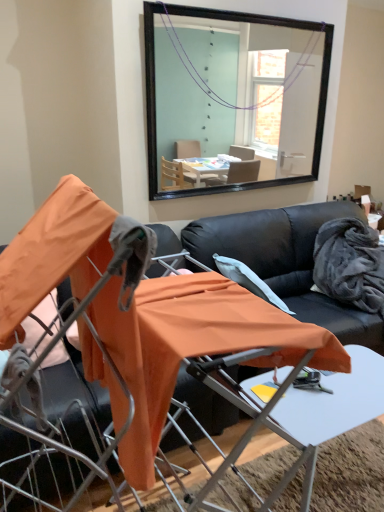
You are a GUI agent. You are given a task and a screenshot of the screen. Output one action in this format:
    pyautogui.click(x=<x>, y=<y>)
    Task: Click on the black leather couch at center
    The width and height of the screenshot is (384, 512).
    Given the screenshot: What is the action you would take?
    pyautogui.click(x=286, y=261)

From the picture: In order to face black leather couch at center, should I rotate leftwards or rightwards?

It's best to rotate right around 15.476 degrees.

Image resolution: width=384 pixels, height=512 pixels. Describe the element at coordinates (304, 414) in the screenshot. I see `orange fabric table at center` at that location.

Measure the distance between orange fabric chair at center, positioned as the second chair in left-to-right order, and camera.

The distance of orange fabric chair at center, positioned as the second chair in left-to-right order, from camera is 27.67 inches.

What do you see at coordinates (62, 446) in the screenshot? I see `orange fabric chair at center, marked as the second chair in a right-to-left arrangement` at bounding box center [62, 446].

What is the approximate width of orange fabric chair at center, marked as the second chair in a right-to-left arrangement?

The width of orange fabric chair at center, marked as the second chair in a right-to-left arrangement, is 64.57 centimeters.

The image size is (384, 512). I want to click on black leather couch at center, so click(286, 261).

Is the surface of velvety gray blanket at right in direct contact with orange fabric chair at center, the 1th chair when ordered from left to right?

No, velvety gray blanket at right is not beside orange fabric chair at center, the 1th chair when ordered from left to right.

How many degrees apart are the facing directions of velvety gray blanket at right and orange fabric chair at center, the 1th chair when ordered from left to right?

→ The angle between the facing direction of velvety gray blanket at right and the facing direction of orange fabric chair at center, the 1th chair when ordered from left to right, is 4.3 degrees.

Is velvety gray blanket at right oriented away from orange fabric chair at center, marked as the second chair in a right-to-left arrangement?

No, velvety gray blanket at right is not facing away from orange fabric chair at center, marked as the second chair in a right-to-left arrangement.

Consider the image. Considering the sizes of objects velvety gray blanket at right and orange fabric chair at center, the 1th chair when ordered from left to right, in the image provided, who is bigger, velvety gray blanket at right or orange fabric chair at center, the 1th chair when ordered from left to right,?

orange fabric chair at center, the 1th chair when ordered from left to right, is bigger.

Between point (289, 241) and point (356, 223), which one is positioned in front?

The point (289, 241) is in front.

Considering the sizes of objects black leather couch at center and velvety gray blanket at right in the image provided, who is smaller, black leather couch at center or velvety gray blanket at right?

velvety gray blanket at right.

Is black leather couch at center touching velvety gray blanket at right?

No, black leather couch at center is not making contact with velvety gray blanket at right.

Does orange fabric table at center lie in front of velvety gray blanket at right?

Yes.

Could you tell me if orange fabric table at center is facing velvety gray blanket at right?

No, orange fabric table at center is not aimed at velvety gray blanket at right.

Visually, is orange fabric table at center positioned to the left or to the right of velvety gray blanket at right?

orange fabric table at center is positioned on velvety gray blanket at right's left side.

Is point (355, 345) positioned before point (358, 254)?

Yes, point (355, 345) is closer to viewer.

From the image's perspective, would you say orange fabric table at center is positioned over orange fabric chair at center, the first chair when ordered from right to left?

Incorrect, from the image's perspective, orange fabric table at center is lower than orange fabric chair at center, the first chair when ordered from right to left.

Identify the location of the 1st chair above the orange fabric table at center (from the image's perspective). (190, 346).

Is orange fabric table at center behind orange fabric chair at center, positioned as the second chair in left-to-right order?

Yes, orange fabric table at center is behind orange fabric chair at center, positioned as the second chair in left-to-right order.

Is orange fabric table at center oriented towards orange fabric chair at center, positioned as the second chair in left-to-right order?

No, orange fabric table at center is not oriented towards orange fabric chair at center, positioned as the second chair in left-to-right order.

Would you say velvety gray blanket at right is to the left or to the right of orange fabric table at center in the picture?

velvety gray blanket at right is positioned on orange fabric table at center's right side.

The width and height of the screenshot is (384, 512). Identify the location of table below the velvety gray blanket at right (from the image's perspective). (304, 414).

Is velvety gray blanket at right beside orange fabric table at center?

velvety gray blanket at right is not next to orange fabric table at center, and they're not touching.

Would you say orange fabric table at center is part of velvety gray blanket at right's contents?

No, orange fabric table at center is not inside velvety gray blanket at right.

Considering the relative sizes of black leather couch at center and orange fabric chair at center, the first chair when ordered from right to left, in the image provided, is black leather couch at center smaller than orange fabric chair at center, the first chair when ordered from right to left,?

No.

Considering the positions of objects black leather couch at center and orange fabric chair at center, the first chair when ordered from right to left, in the image provided, who is more to the right, black leather couch at center or orange fabric chair at center, the first chair when ordered from right to left,?

black leather couch at center is more to the right.

The image size is (384, 512). I want to click on chair located below the black leather couch at center (from the image's perspective), so click(x=190, y=346).

From a real-world perspective, is black leather couch at center located beneath orange fabric chair at center, the first chair when ordered from right to left?

Yes, from a real-world perspective, black leather couch at center is under orange fabric chair at center, the first chair when ordered from right to left.

Considering the relative sizes of black leather couch at center and orange fabric chair at center, marked as the second chair in a right-to-left arrangement, in the image provided, is black leather couch at center shorter than orange fabric chair at center, marked as the second chair in a right-to-left arrangement,?

No, black leather couch at center is not shorter than orange fabric chair at center, marked as the second chair in a right-to-left arrangement.

Considering the positions of objects black leather couch at center and orange fabric chair at center, the 1th chair when ordered from left to right, in the image provided, who is more to the left, black leather couch at center or orange fabric chair at center, the 1th chair when ordered from left to right,?

orange fabric chair at center, the 1th chair when ordered from left to right, is more to the left.

Between point (282, 219) and point (92, 432), which one is positioned behind?

The point (282, 219) is farther.

Identify the location of fabric on the right of the orange fabric chair at center, the 1th chair when ordered from left to right. (350, 264).

This screenshot has height=512, width=384. In order to click on fabric above the black leather couch at center (from a real-world perspective) in this screenshot , I will do [x=350, y=264].

Which object lies further to the anchor point orange fabric chair at center, the first chair when ordered from right to left, black leather couch at center or orange fabric chair at center, marked as the second chair in a right-to-left arrangement?

Among the two, black leather couch at center is located further to orange fabric chair at center, the first chair when ordered from right to left.

Which object lies further to the anchor point velvety gray blanket at right, orange fabric chair at center, marked as the second chair in a right-to-left arrangement, or orange fabric table at center?

orange fabric chair at center, marked as the second chair in a right-to-left arrangement, is positioned further to the anchor velvety gray blanket at right.

Based on their spatial positions, is orange fabric table at center or orange fabric chair at center, positioned as the second chair in left-to-right order, closer to orange fabric chair at center, the 1th chair when ordered from left to right?

Based on the image, orange fabric chair at center, positioned as the second chair in left-to-right order, appears to be nearer to orange fabric chair at center, the 1th chair when ordered from left to right.

Based on their spatial positions, is black leather couch at center or velvety gray blanket at right further from orange fabric table at center?

velvety gray blanket at right is further to orange fabric table at center.

Considering their positions, is orange fabric chair at center, positioned as the second chair in left-to-right order, positioned closer to velvety gray blanket at right than orange fabric table at center?

orange fabric table at center.

Looking at the image, which one is located closer to velvety gray blanket at right, orange fabric table at center or orange fabric chair at center, positioned as the second chair in left-to-right order?

orange fabric table at center lies closer to velvety gray blanket at right than the other object.

Looking at the image, which one is located closer to orange fabric chair at center, the 1th chair when ordered from left to right, orange fabric chair at center, the first chair when ordered from right to left, or velvety gray blanket at right?

orange fabric chair at center, the first chair when ordered from right to left.

Which object lies nearer to the anchor point orange fabric chair at center, the 1th chair when ordered from left to right, orange fabric table at center or velvety gray blanket at right?

orange fabric table at center lies closer to orange fabric chair at center, the 1th chair when ordered from left to right, than the other object.

Locate an element on the screen. The height and width of the screenshot is (512, 384). couch between orange fabric table at center and velvety gray blanket at right along the z-axis is located at coordinates (286, 261).

Where is `table positioned between orange fabric chair at center, the first chair when ordered from right to left, and velvety gray blanket at right from near to far`? The width and height of the screenshot is (384, 512). table positioned between orange fabric chair at center, the first chair when ordered from right to left, and velvety gray blanket at right from near to far is located at coordinates (304, 414).

The width and height of the screenshot is (384, 512). I want to click on chair located between orange fabric chair at center, the first chair when ordered from right to left, and black leather couch at center in the depth direction, so (x=62, y=446).

Image resolution: width=384 pixels, height=512 pixels. Find the location of `couch located between orange fabric chair at center, positioned as the second chair in left-to-right order, and velvety gray blanket at right in the depth direction`. couch located between orange fabric chair at center, positioned as the second chair in left-to-right order, and velvety gray blanket at right in the depth direction is located at coordinates (286, 261).